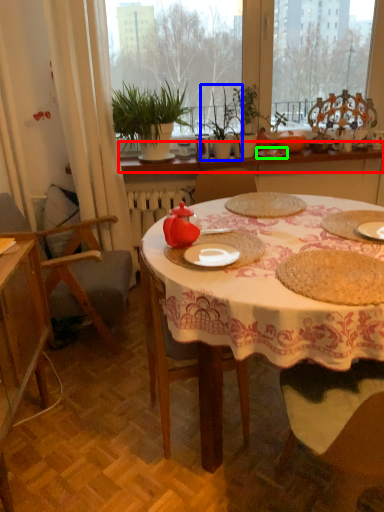
Question: Considering the real-world distances, which object is closest to window sill (highlighted by a red box)? plant (highlighted by a blue box) or tableware (highlighted by a green box).

Choices:
 (A) plant
 (B) tableware

Answer: (A)